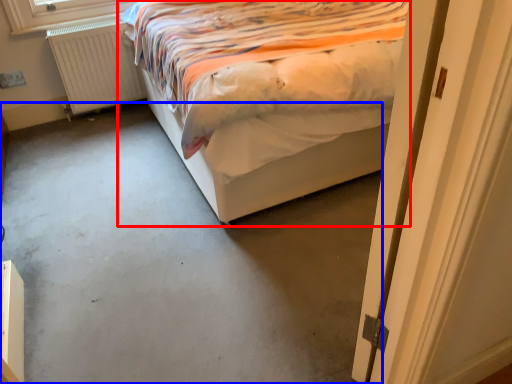
Question: Which point is closer to the camera, bed (highlighted by a red box) or concrete (highlighted by a blue box)?

Choices:
 (A) bed
 (B) concrete

Answer: (B)